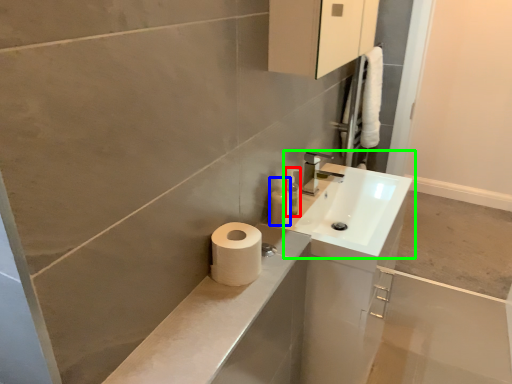
Question: Estimate the real-world distances between objects in this image. Which object is farther from soap dispenser (highlighted by a red box), toiletry (highlighted by a blue box) or sink (highlighted by a green box)?

Choices:
 (A) toiletry
 (B) sink

Answer: (B)